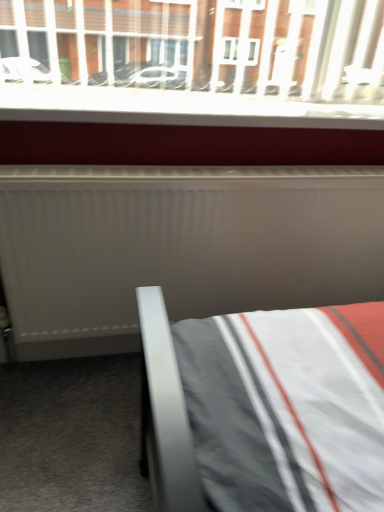
Question: From the image's perspective, is white plastic window sill at upper center above or below white matte radiator at center?

Choices:
 (A) below
 (B) above

Answer: (B)

Question: In terms of width, does white plastic window sill at upper center look wider or thinner when compared to white matte radiator at center?

Choices:
 (A) wide
 (B) thin

Answer: (A)

Question: Relative to white matte radiator at center, is white plastic window sill at upper center in front or behind?

Choices:
 (A) front
 (B) behind

Answer: (B)

Question: In terms of height, does white matte radiator at center look taller or shorter compared to white plastic window sill at upper center?

Choices:
 (A) short
 (B) tall

Answer: (B)

Question: Is white matte radiator at center bigger or smaller than white plastic window sill at upper center?

Choices:
 (A) small
 (B) big

Answer: (B)

Question: Considering their positions, is white matte radiator at center located in front of or behind white plastic window sill at upper center?

Choices:
 (A) behind
 (B) front

Answer: (B)

Question: Considering the relative positions of white matte radiator at center and white plastic window sill at upper center in the image provided, is white matte radiator at center to the left or to the right of white plastic window sill at upper center?

Choices:
 (A) right
 (B) left

Answer: (A)